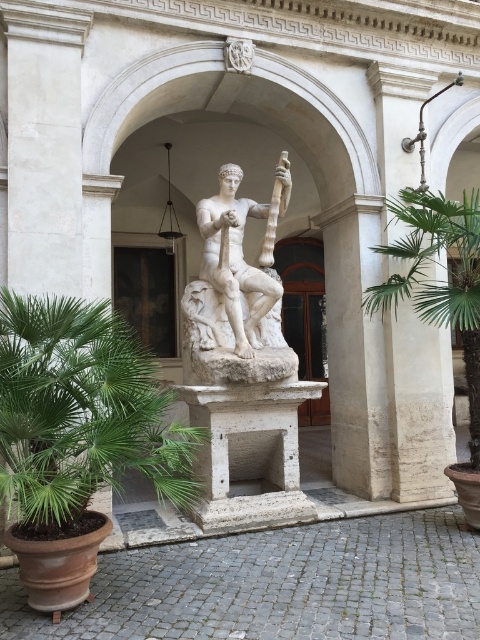
Is white marble statue at center thinner than green leafy palm at right?

Correct, white marble statue at center's width is less than green leafy palm at right's.

Does point (263, 216) lie in front of point (419, 257)?

No, it is behind (419, 257).

At what (x,y) coordinates should I click in order to perform the action: click on white marble statue at center. Please return your answer as a coordinate pair (x, y). Looking at the image, I should click on (236, 289).